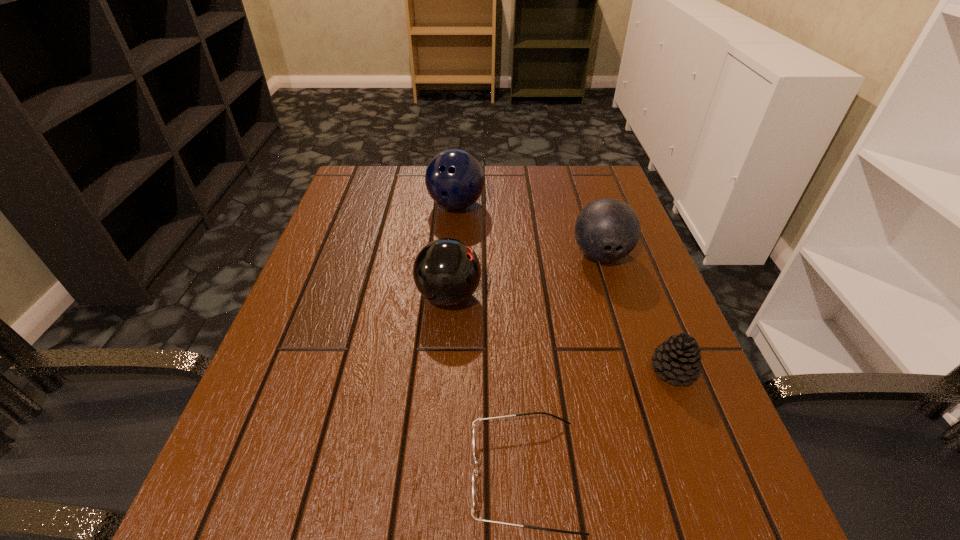
Where is `object identified as the second closest to the farthest object`? object identified as the second closest to the farthest object is located at coordinates (607, 229).

I want to click on object that is the second closest to the farthest bowling ball, so click(x=607, y=229).

The width and height of the screenshot is (960, 540). I want to click on bowling ball identified as the closest to the farthest bowling ball, so click(447, 271).

Locate an element on the screen. The width and height of the screenshot is (960, 540). bowling ball that is the third closest one to the shortest object is located at coordinates (455, 179).

Image resolution: width=960 pixels, height=540 pixels. I want to click on free space that satisfies the following two spatial constraints: 1. on the grip area of the rightmost bowling ball; 2. through the lenses of the nearest object, so click(x=672, y=475).